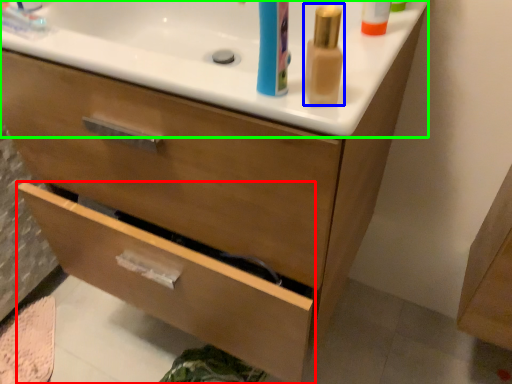
Question: Based on their relative distances, which object is nearer to drawer (highlighted by a red box)? Choose from mouthwash (highlighted by a blue box) and counter top (highlighted by a green box).

Choices:
 (A) mouthwash
 (B) counter top

Answer: (B)